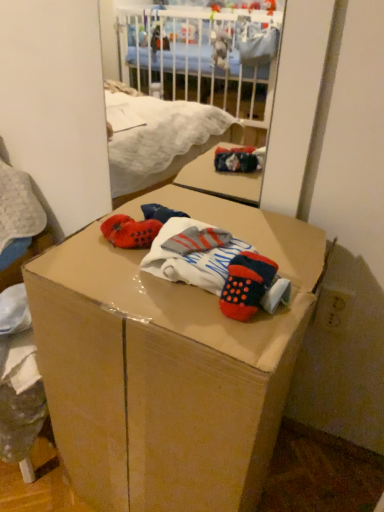
Question: Is cardboard box at center spatially inside knitted wool socks at center, or outside of it?

Choices:
 (A) outside
 (B) inside

Answer: (A)

Question: Considering the positions of point (74, 410) and point (241, 244), is point (74, 410) closer or farther from the camera than point (241, 244)?

Choices:
 (A) closer
 (B) farther

Answer: (B)

Question: Is cardboard box at center to the left or to the right of knitted wool socks at center in the image?

Choices:
 (A) left
 (B) right

Answer: (A)

Question: Is knitted wool socks at center bigger or smaller than cardboard box at center?

Choices:
 (A) big
 (B) small

Answer: (B)

Question: Is knitted wool socks at center wider or thinner than cardboard box at center?

Choices:
 (A) wide
 (B) thin

Answer: (B)

Question: Considering the positions of knitted wool socks at center and cardboard box at center in the image, is knitted wool socks at center taller or shorter than cardboard box at center?

Choices:
 (A) tall
 (B) short

Answer: (B)

Question: Which is correct: knitted wool socks at center is inside cardboard box at center, or outside of it?

Choices:
 (A) outside
 (B) inside

Answer: (B)